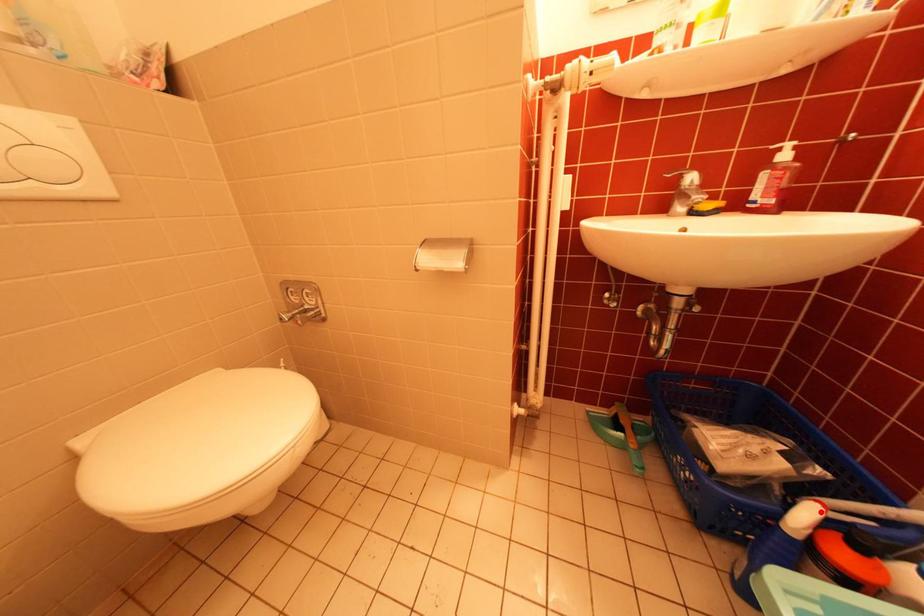
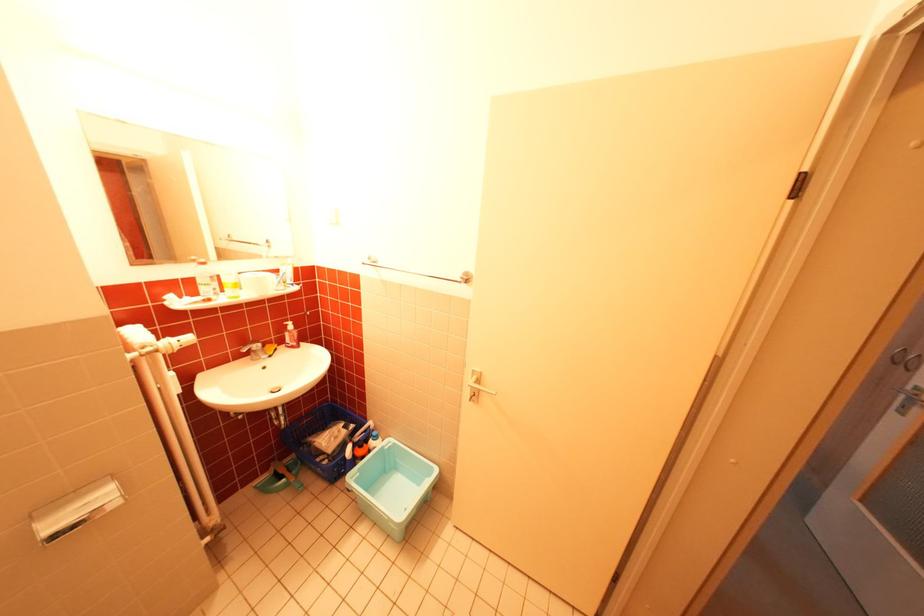
Question: A red point is marked in image1. In image2, is the corresponding 3D point closer to the camera or farther? Reply with the corresponding letter.

Choices:
 (A) The corresponding 3D point is closer.
 (B) The corresponding 3D point is farther.

Answer: (B)